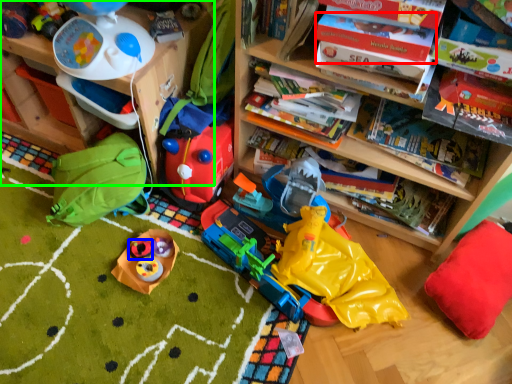
Question: Which object is the farthest from book (highlighted by a red box)? Choose among these: toy (highlighted by a blue box) or shelf (highlighted by a green box).

Choices:
 (A) toy
 (B) shelf

Answer: (A)